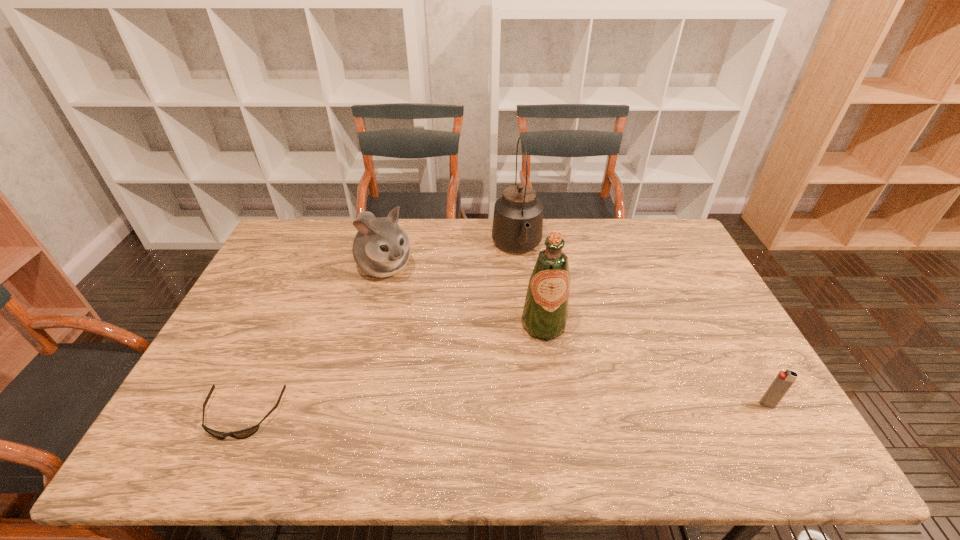
Where is `vacant space situated on the face of the fourth object from right to left`? The image size is (960, 540). vacant space situated on the face of the fourth object from right to left is located at coordinates (456, 343).

This screenshot has height=540, width=960. Identify the location of vacant region located on the face of the fourth object from right to left. (423, 308).

I want to click on vacant space located on the face of the fourth object from right to left, so (447, 335).

Where is `free space located spout on the kettle`? The height and width of the screenshot is (540, 960). free space located spout on the kettle is located at coordinates (536, 319).

Identify the location of vacant position located 0.290m spout on the kettle. (540, 337).

I want to click on free location located 0.390m spout on the kettle, so click(548, 366).

The image size is (960, 540). Find the location of `blank space located on the front-facing side of the third farthest object`. blank space located on the front-facing side of the third farthest object is located at coordinates (562, 396).

Where is `free space located on the front-facing side of the third farthest object`? free space located on the front-facing side of the third farthest object is located at coordinates (564, 403).

This screenshot has height=540, width=960. Find the location of `free spot located on the front-facing side of the third farthest object`. free spot located on the front-facing side of the third farthest object is located at coordinates (557, 379).

Find the location of a particular element. The height and width of the screenshot is (540, 960). hamster that is positioned at the far edge is located at coordinates (381, 248).